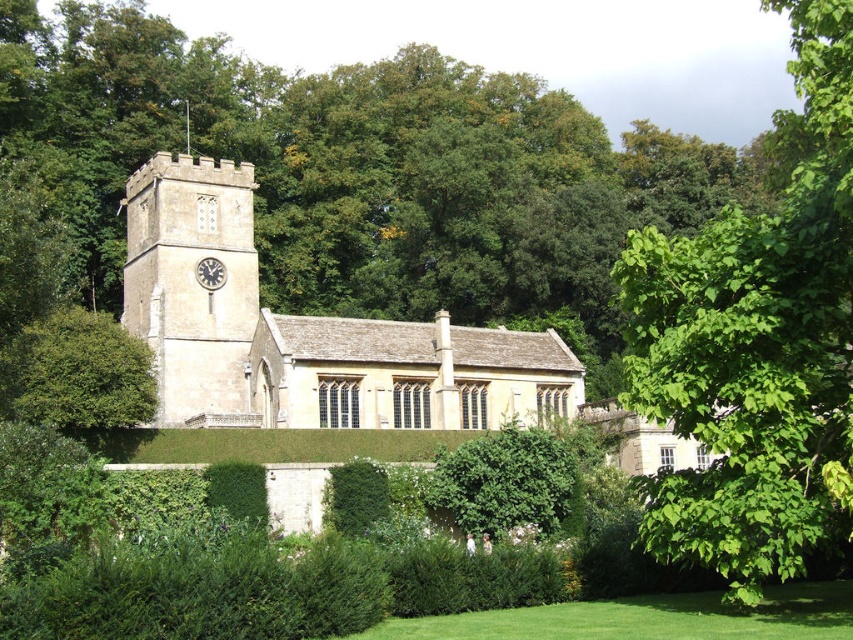
You are standing in front of the historic stone church and want to take a photo. You notice two points marked in the scene at coordinates point (676, 522) and point (207, 275). Which point should you focus on to ensure it appears closer in your photo?

Point (676, 522) is closer to the camera than point (207, 275), so focusing on point (676, 522) will make it appear closer in your photo.

You are a visitor at the church and want to take a photo of both the green leafy tree at center and the matte stone clock at upper left. Since you want both objects to be clearly visible in the frame, which object should you focus on to ensure it appears larger in your photo?

The green leafy tree at center is larger in size than the matte stone clock at upper left, so you should focus on the green leafy tree at center to ensure it appears larger in the photo.

You are standing in front of the historic stone church and notice two plants at the center of the image. Which one is taller between the green leafy tree at center and the green leafy bush at center?

The green leafy tree at center is taller than the green leafy bush at center according to the description.